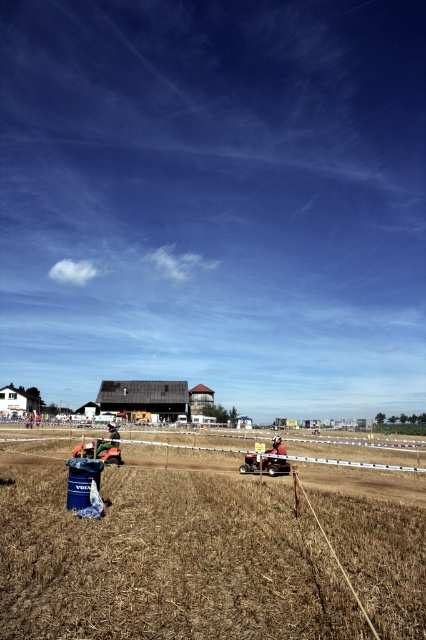
Based on the photo, you are a farmer driving a metallic silver motorcycle at center and want to overtake the metallic red plow at center ahead of you. Is there enough space on the dirt track to safely pass on the right side?

The metallic red plow at center is in front of the metallic silver motorcycle at center, but there is no information provided about the width of the dirt track or the space available for overtaking. Therefore, it is uncertain if there is enough space to safely pass on the right side.

You are standing at the origin point of the coordinate system in this rural landscape. You want to locate the brown dry grass at center. What are its coordinates?

The brown dry grass at center is located at coordinates point (x=164, y=554).

You are a farmer checking the field. You see the brown dry grass at center and the metallic red plow at center. Which object takes up more horizontal space in the image?

The brown dry grass at center might be wider than metallic red plow at center.